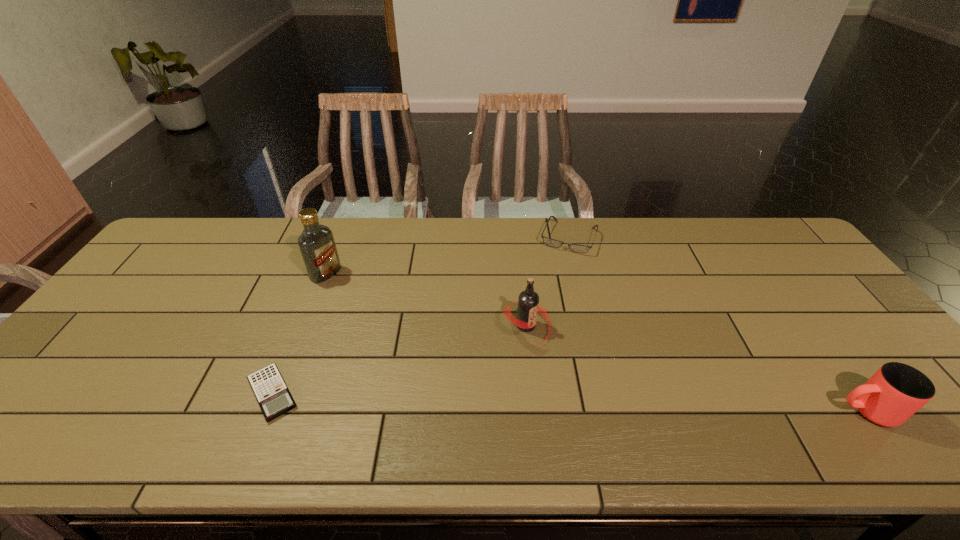
The height and width of the screenshot is (540, 960). What are the coordinates of `calculator` in the screenshot? It's located at (274, 398).

What are the coordinates of `the rightmost object` in the screenshot? It's located at (896, 391).

You are a GUI agent. You are given a task and a screenshot of the screen. Output one action in this format:
    pyautogui.click(x=<x>, y=<y>)
    Task: Click on the third shortest object
    
    Given the screenshot: What is the action you would take?
    pyautogui.click(x=896, y=391)

Image resolution: width=960 pixels, height=540 pixels. I want to click on the second shortest object, so click(x=548, y=241).

In order to click on the farthest object in this screenshot , I will do `click(548, 241)`.

Image resolution: width=960 pixels, height=540 pixels. In order to click on root beer in this screenshot , I will do pos(528,304).

Find the location of a particular element. The width and height of the screenshot is (960, 540). the fourth shortest object is located at coordinates (528, 304).

Locate an element on the screen. The image size is (960, 540). the fourth nearest object is located at coordinates (316, 243).

Locate an element on the screen. Image resolution: width=960 pixels, height=540 pixels. vodka is located at coordinates (316, 243).

Identify the location of free space located 0.300m on the left of the calculator. (113, 393).